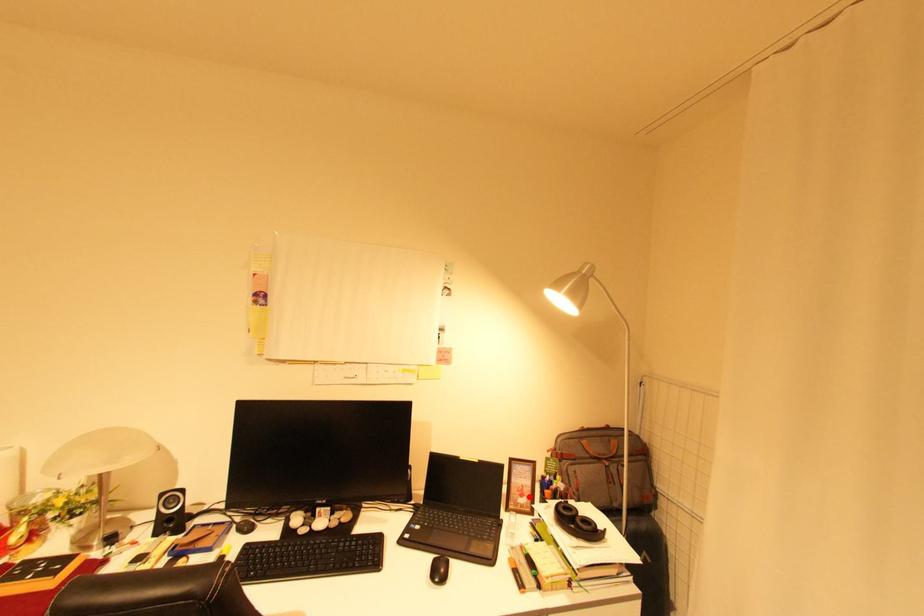
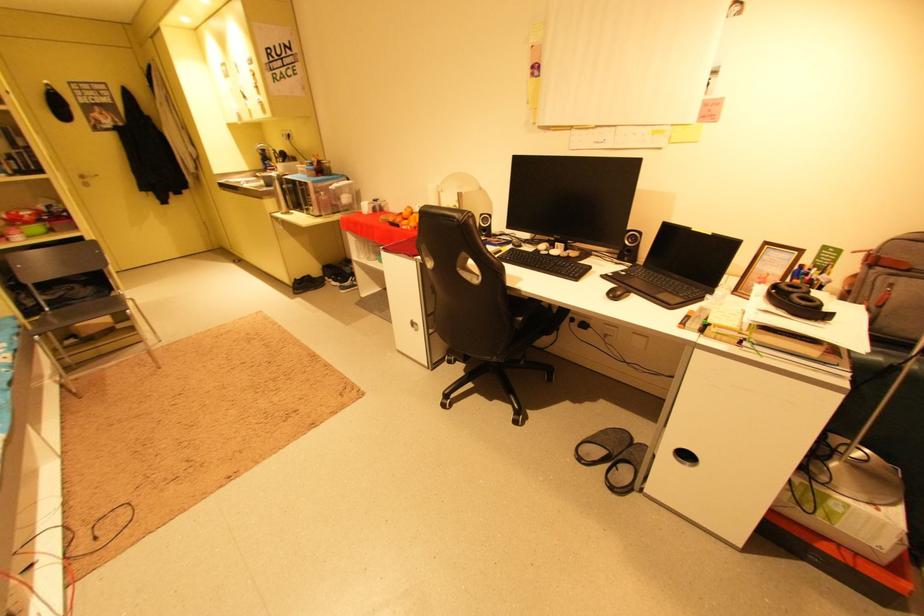
Locate, in the second image, the point that corresponds to the highlighted location in the first image.

(769, 285)